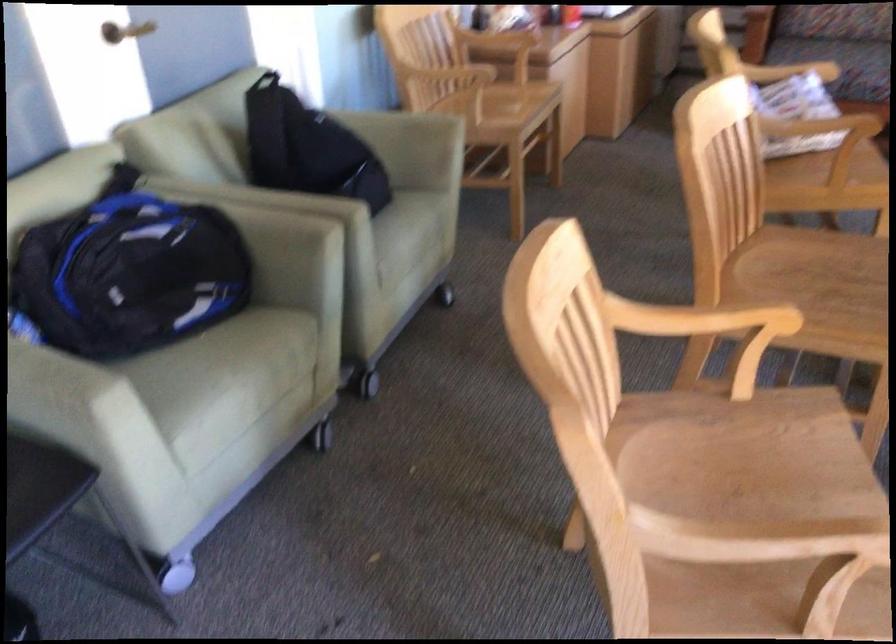
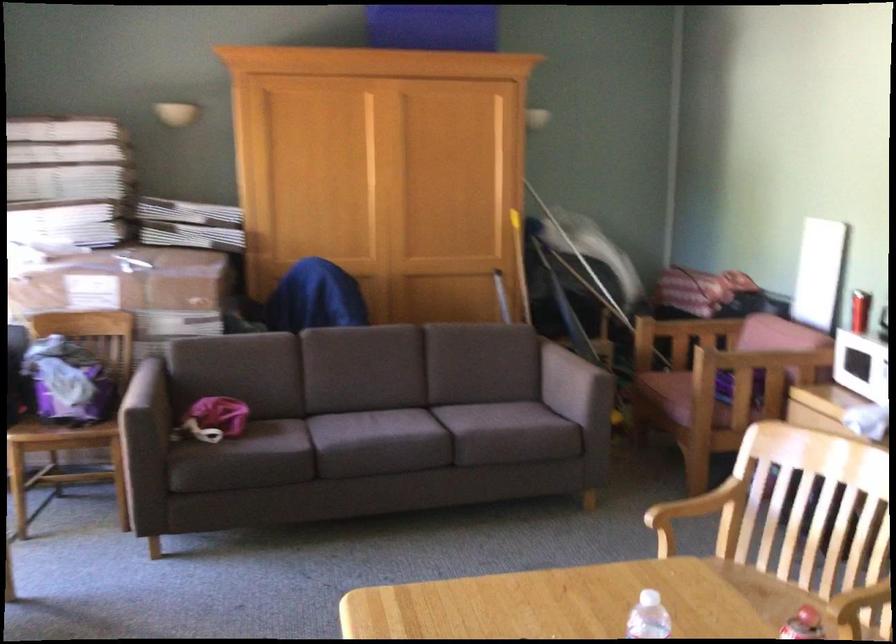
In the second image, find the point that corresponds to the point at 687,532 in the first image.

(694, 512)